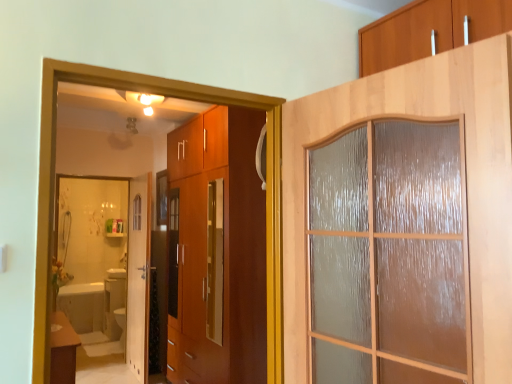
Question: Considering the relative positions of white glossy door at center, the 1th door positioned from the back, and wooden frosted glass door at upper right, the first door when ordered from front to back, in the image provided, is white glossy door at center, the 1th door positioned from the back, behind wooden frosted glass door at upper right, the first door when ordered from front to back,?

Choices:
 (A) no
 (B) yes

Answer: (B)

Question: Does white glossy door at center, the 1th door when ordered from left to right, have a larger size compared to wooden frosted glass door at upper right, acting as the 1th door starting from the right?

Choices:
 (A) yes
 (B) no

Answer: (B)

Question: Could wooden frosted glass door at upper right, acting as the 1th door starting from the right, be considered to be inside white glossy door at center, acting as the second door starting from the front?

Choices:
 (A) no
 (B) yes

Answer: (A)

Question: Are white glossy door at center, the 1th door when ordered from left to right, and wooden frosted glass door at upper right, acting as the 1th door starting from the right, far apart?

Choices:
 (A) no
 (B) yes

Answer: (B)

Question: Can you confirm if white glossy door at center, the 1th door when ordered from left to right, is positioned to the right of wooden frosted glass door at upper right, the first door when ordered from front to back?

Choices:
 (A) yes
 (B) no

Answer: (B)

Question: Considering the relative sizes of white glossy door at center, the 1th door positioned from the back, and wooden frosted glass door at upper right, the 2th door when ordered from left to right, in the image provided, is white glossy door at center, the 1th door positioned from the back, shorter than wooden frosted glass door at upper right, the 2th door when ordered from left to right,?

Choices:
 (A) no
 (B) yes

Answer: (A)

Question: From the image's perspective, is white glossy bathtub at lower left located beneath white glossy mirror at lower left?

Choices:
 (A) yes
 (B) no

Answer: (A)

Question: From the image's perspective, would you say white glossy bathtub at lower left is positioned over white glossy mirror at lower left?

Choices:
 (A) no
 (B) yes

Answer: (A)

Question: Does white glossy bathtub at lower left have a lesser width compared to white glossy mirror at lower left?

Choices:
 (A) yes
 (B) no

Answer: (B)

Question: Is white glossy bathtub at lower left outside of white glossy mirror at lower left?

Choices:
 (A) no
 (B) yes

Answer: (B)

Question: Does white glossy bathtub at lower left have a lesser height compared to white glossy mirror at lower left?

Choices:
 (A) yes
 (B) no

Answer: (A)

Question: Are white glossy bathtub at lower left and white glossy mirror at lower left beside each other?

Choices:
 (A) no
 (B) yes

Answer: (A)

Question: Does matte brown table at lower left turn towards wooden frosted glass door at upper right, the first door when ordered from front to back?

Choices:
 (A) no
 (B) yes

Answer: (A)